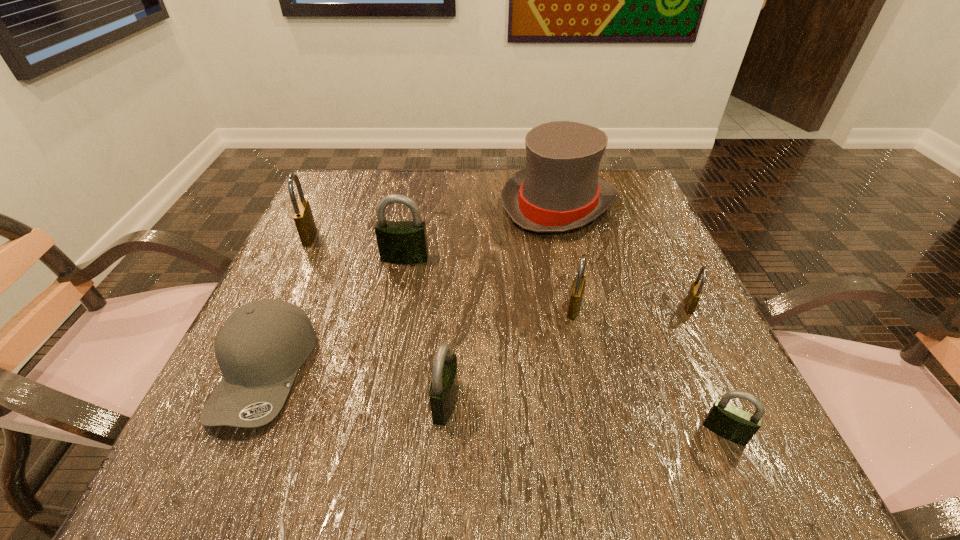
Find the location of a particular element. vacant region at the right edge of the desktop is located at coordinates (669, 368).

Where is `free spot at the far left corner of the desktop`? free spot at the far left corner of the desktop is located at coordinates (390, 173).

Where is `vacant space at the far right corner of the desktop`? This screenshot has height=540, width=960. vacant space at the far right corner of the desktop is located at coordinates (627, 215).

Find the location of a particular element. free space at the near right corner is located at coordinates (738, 444).

This screenshot has height=540, width=960. Identify the location of free spot between the sixth object from right to left and the second biggest black padlock. (425, 330).

What are the coordinates of `free space that is in between the rightmost brass padlock and the third padlock from right to left` in the screenshot? It's located at (632, 307).

The height and width of the screenshot is (540, 960). In order to click on free space that is in between the rightmost brass padlock and the second brass padlock from right to left in this screenshot , I will do `click(632, 307)`.

Where is `unoccupied area between the dress hat and the third farthest object`? The height and width of the screenshot is (540, 960). unoccupied area between the dress hat and the third farthest object is located at coordinates (481, 232).

You are a GUI agent. You are given a task and a screenshot of the screen. Output one action in this format:
    pyautogui.click(x=<x>, y=<y>)
    Task: Click on the vacant space that's between the leftmost black padlock and the farthest brass padlock
    The image size is (960, 540).
    Given the screenshot: What is the action you would take?
    pyautogui.click(x=357, y=247)

You are a GUI agent. You are given a task and a screenshot of the screen. Output one action in this format:
    pyautogui.click(x=<x>, y=<y>)
    Task: Click on the free spot between the fourth padlock from right to left and the gray baseball cap
    The height and width of the screenshot is (540, 960).
    Given the screenshot: What is the action you would take?
    pyautogui.click(x=355, y=387)